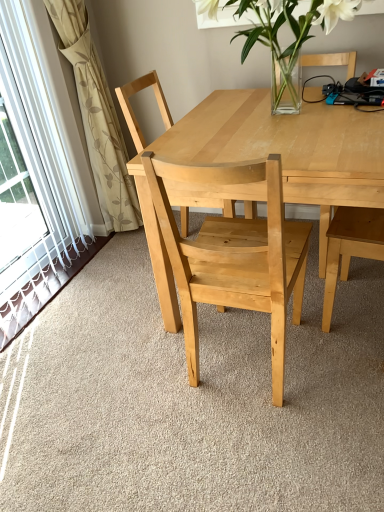
You are a GUI agent. You are given a task and a screenshot of the screen. Output one action in this format:
    pyautogui.click(x=<x>, y=<y>)
    Task: Click on the free space above natural wood table at center (from a real-world perspective)
    This screenshot has height=512, width=384.
    Given the screenshot: What is the action you would take?
    tap(274, 117)